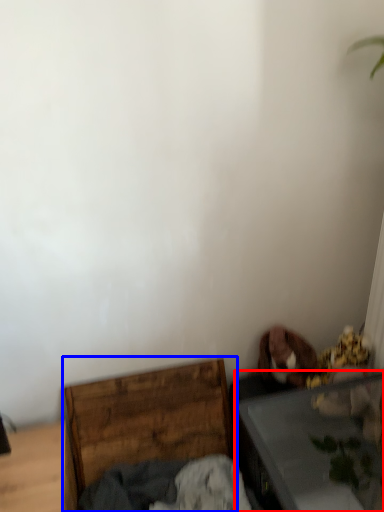
Question: Which of the following is the farthest to the observer, table (highlighted by a red box) or furniture (highlighted by a blue box)?

Choices:
 (A) table
 (B) furniture

Answer: (B)